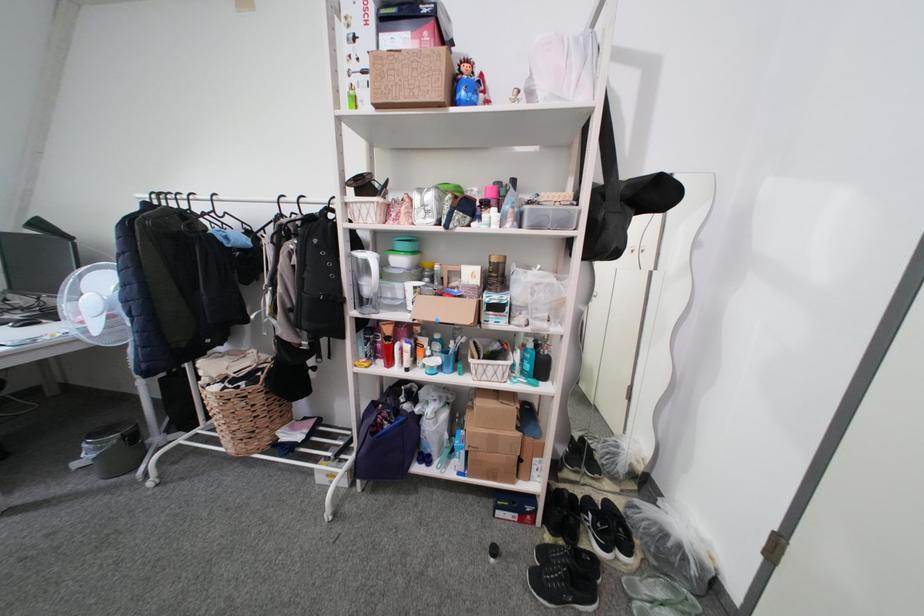
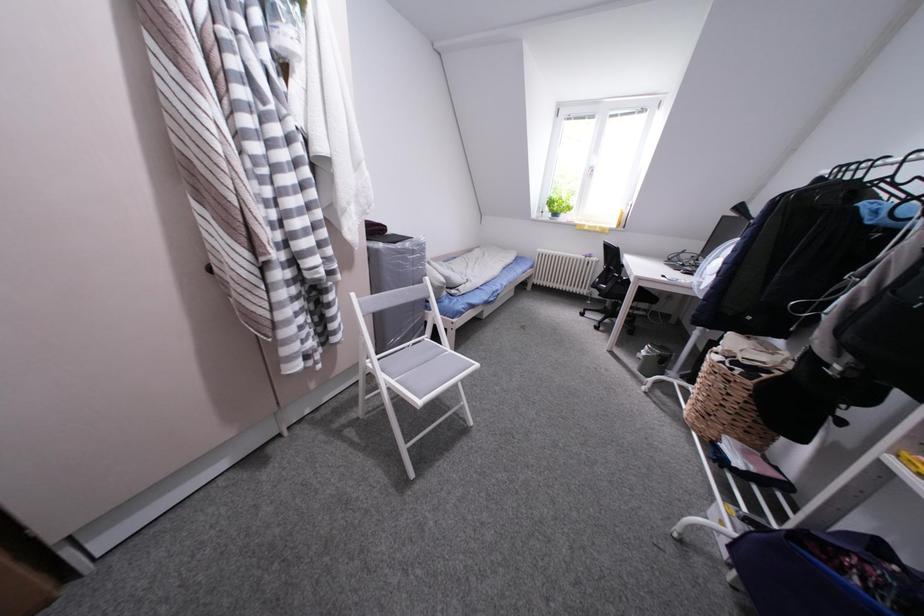
The first image is from the beginning of the video and the second image is from the end. How did the camera likely rotate when shooting the video?

The camera's rotation is toward left-down.